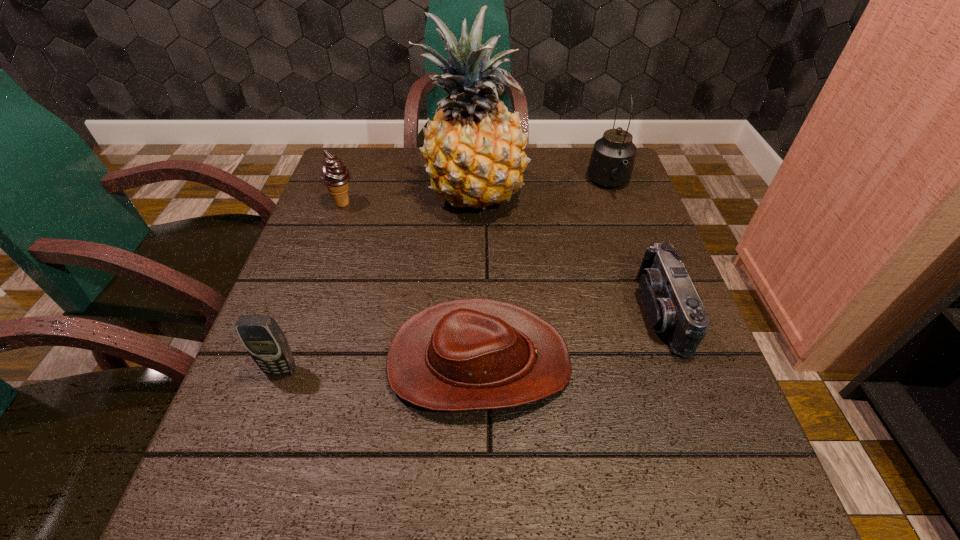
What are the coordinates of `camcorder that is at the right edge` in the screenshot? It's located at (671, 300).

Find the location of a particular element. object that is at the far left corner is located at coordinates (335, 176).

The width and height of the screenshot is (960, 540). I want to click on object located in the far right corner section of the desktop, so [611, 164].

Where is `free location at the far edge of the desktop`? The image size is (960, 540). free location at the far edge of the desktop is located at coordinates (411, 156).

In the image, there is a desktop. In order to click on vacant space at the near edge in this screenshot , I will do `click(490, 503)`.

Locate an element on the screen. The width and height of the screenshot is (960, 540). free spot at the left edge of the desktop is located at coordinates (347, 323).

You are a GUI agent. You are given a task and a screenshot of the screen. Output one action in this format:
    pyautogui.click(x=<x>, y=<y>)
    Task: Click on the vacant space at the right edge of the desktop
    
    Given the screenshot: What is the action you would take?
    pyautogui.click(x=601, y=244)

Where is `blank space at the far left corner of the desktop`? blank space at the far left corner of the desktop is located at coordinates (357, 153).

Find the location of `vacant space at the near left corner of the desktop`. vacant space at the near left corner of the desktop is located at coordinates (308, 496).

Locate an element on the screen. This screenshot has width=960, height=540. vacant space that's between the second shortest object and the tallest object is located at coordinates (567, 254).